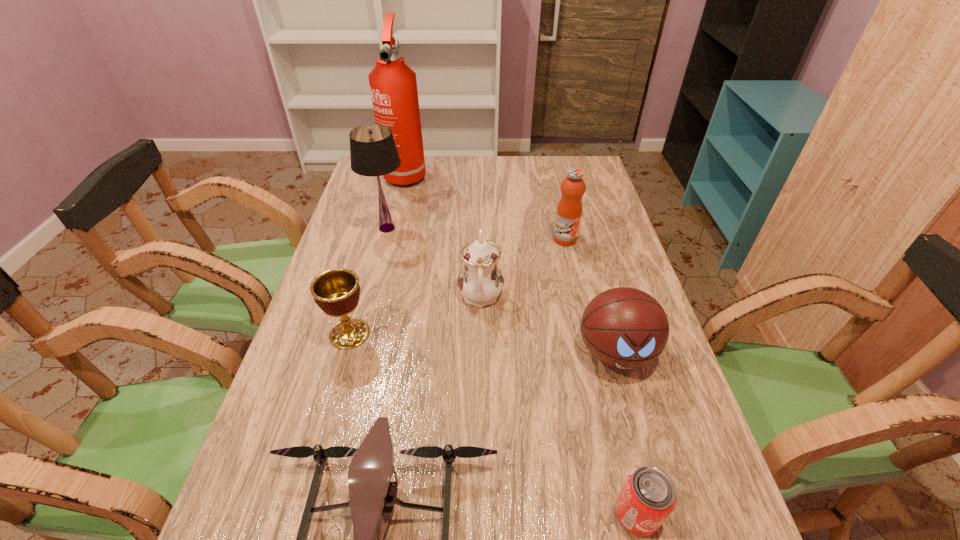
This screenshot has width=960, height=540. I want to click on free space between the chalice and the lampshade, so click(369, 281).

Select which object is the second closest to the chalice. Please provide its 2D coordinates. Your answer should be formatted as a tuple, i.e. [(x, y)], where the tuple contains the x and y coordinates of a point satisfying the conditions above.

[(373, 495)]

You are a GUI agent. You are given a task and a screenshot of the screen. Output one action in this format:
    pyautogui.click(x=<x>, y=<y>)
    Task: Click on the object that stands as the fourth closest to the lampshade
    
    Given the screenshot: What is the action you would take?
    pyautogui.click(x=569, y=209)

Find the location of `vacant point that satisfies the following two spatial constraints: 1. on the front-facing side of the lampshade; 2. on the right side of the basketball`. vacant point that satisfies the following two spatial constraints: 1. on the front-facing side of the lampshade; 2. on the right side of the basketball is located at coordinates (355, 353).

This screenshot has width=960, height=540. Identify the location of free space that satisfies the following two spatial constraints: 1. on the front side of the chinaware; 2. on the right side of the can. (481, 514).